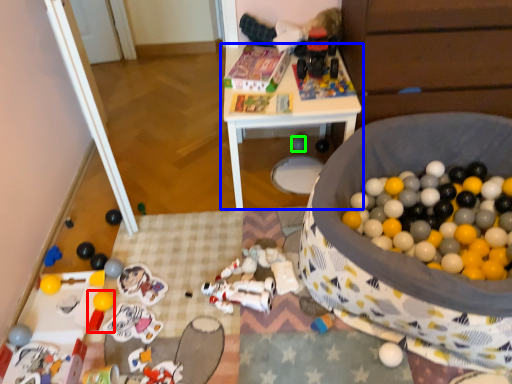
Question: Which object is positioned farthest from toy (highlighted by a red box)? Select from table (highlighted by a blue box) and toy (highlighted by a green box).

Choices:
 (A) table
 (B) toy

Answer: (B)